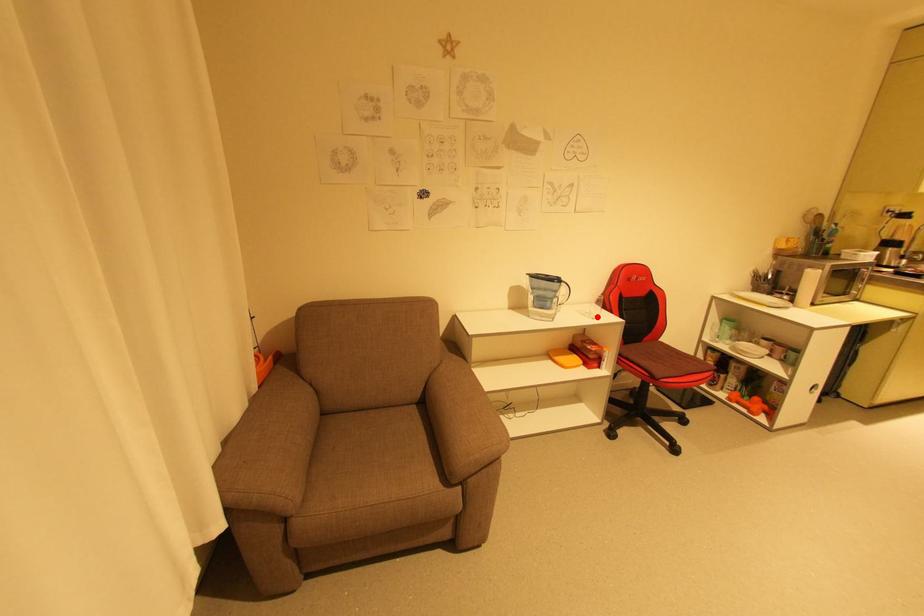
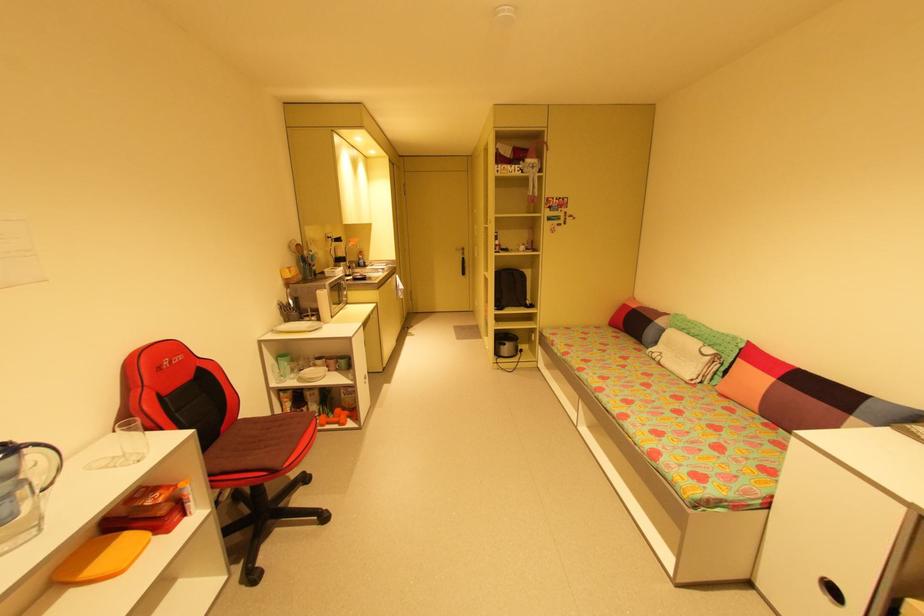
Where in the second image is the point corresponding to the highlighted location from the first image?

(139, 459)